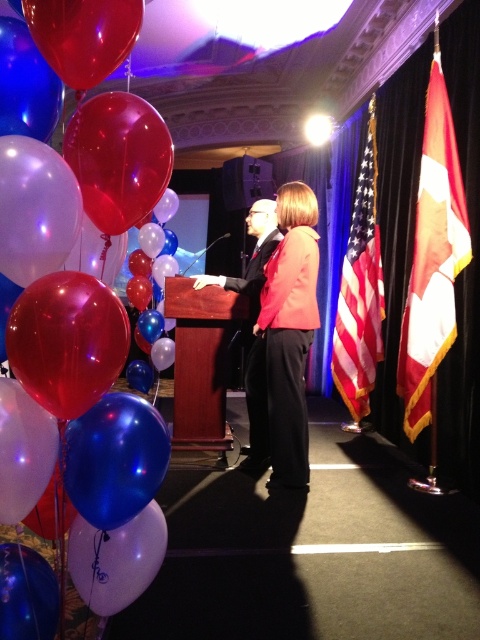
Question: Which object appears farthest from the camera in this image?

Choices:
 (A) red and white fabric flag at right
 (B) matte red blazer at center
 (C) american flag at right

Answer: (C)

Question: Can you confirm if red and white fabric flag at right is positioned above matte red blazer at center?

Choices:
 (A) yes
 (B) no

Answer: (A)

Question: Based on their relative distances, which object is farther from the matte red blazer at center?

Choices:
 (A) red and white fabric flag at right
 (B) red translucent balloon at left
 (C) american flag at right

Answer: (B)

Question: Which object appears farthest from the camera in this image?

Choices:
 (A) matte red blazer at center
 (B) red translucent balloon at left

Answer: (A)

Question: Does red translucent balloon at left come in front of mahogany wood podium at center?

Choices:
 (A) yes
 (B) no

Answer: (A)

Question: Is red translucent balloon at left above matte red blazer at center?

Choices:
 (A) no
 (B) yes

Answer: (B)